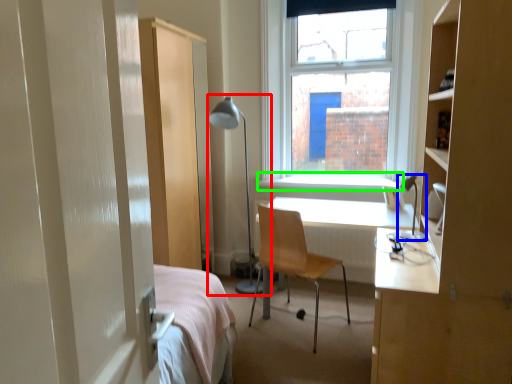
Question: Which object is positioned closest to table lamp (highlighted by a red box)? Select from table lamp (highlighted by a blue box) and window sill (highlighted by a green box).

Choices:
 (A) table lamp
 (B) window sill

Answer: (B)